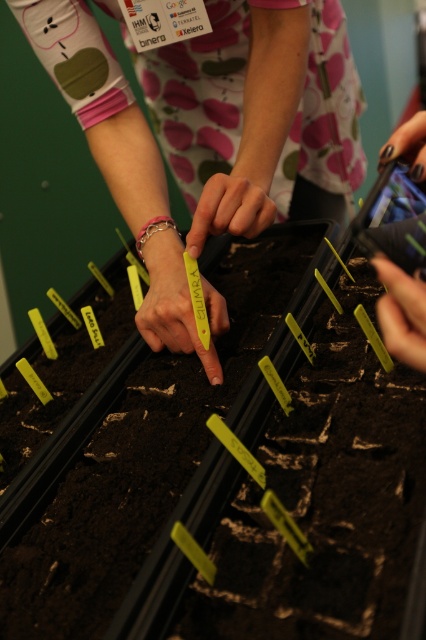
You are a gardener who needs to place a 10 inch ruler between the smooth yellow tag at center and the black nail polish at center. Is there enough space to fit the ruler between them?

The smooth yellow tag at center is 9.32 inches from the black nail polish at center. Since the ruler is 10 inches long, it won not fit between them because the distance is shorter than the ruler.

You are a gardener looking at the seedling trays. Where is the yellow paper tag at center positioned relative to the trays?

The yellow paper tag at center is located at point (x=256, y=113) relative to the trays.

You are a gardener trying to label seedlings. You have two tags, the yellow paper tag at center and the yellow plastic tag at center. Which one is wider?

The yellow paper tag at center is wider than the yellow plastic tag at center according to the description.